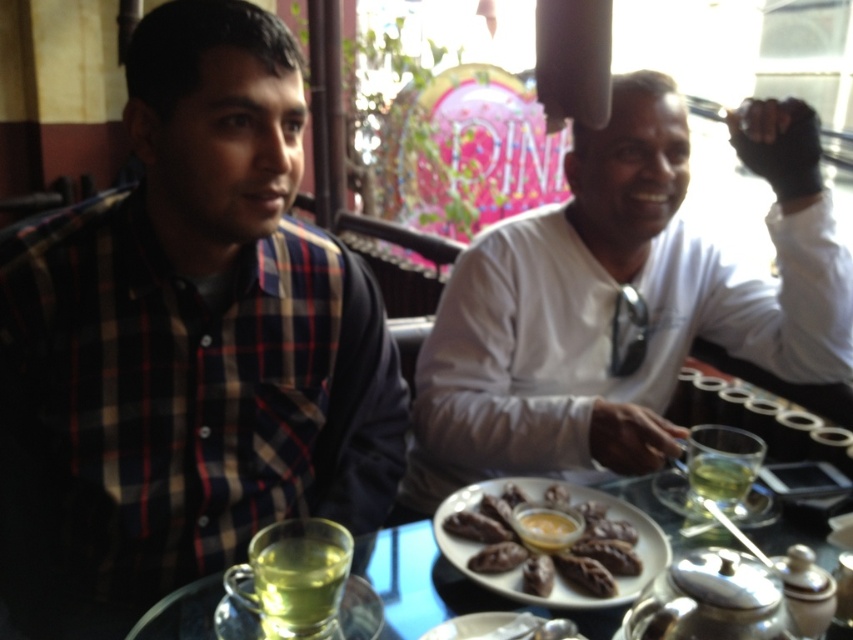
Is plaid shirt at left positioned behind green glass cup at lower left?

Yes.

Does plaid shirt at left lie in front of green glass cup at lower left?

No, it is behind green glass cup at lower left.

Is point (148, 467) positioned in front of point (254, 592)?

No.

You are a GUI agent. You are given a task and a screenshot of the screen. Output one action in this format:
    pyautogui.click(x=<x>, y=<y>)
    Task: Click on the plaid shirt at left
    The image size is (853, 640).
    Given the screenshot: What is the action you would take?
    pyautogui.click(x=184, y=342)

What do you see at coordinates (440, 586) in the screenshot? I see `clear glass plate at center` at bounding box center [440, 586].

Find the location of a particular element. Image resolution: width=853 pixels, height=640 pixels. clear glass plate at center is located at coordinates (440, 586).

I want to click on clear glass plate at center, so click(440, 586).

Who is lower down, green glass cup at lower left or green glass at center?

green glass cup at lower left is below.

Is green glass cup at lower left shorter than green glass at center?

In fact, green glass cup at lower left may be taller than green glass at center.

Does point (334, 600) come farther from viewer compared to point (711, 460)?

No.

Where is `green glass cup at lower left`? green glass cup at lower left is located at coordinates (299, 582).